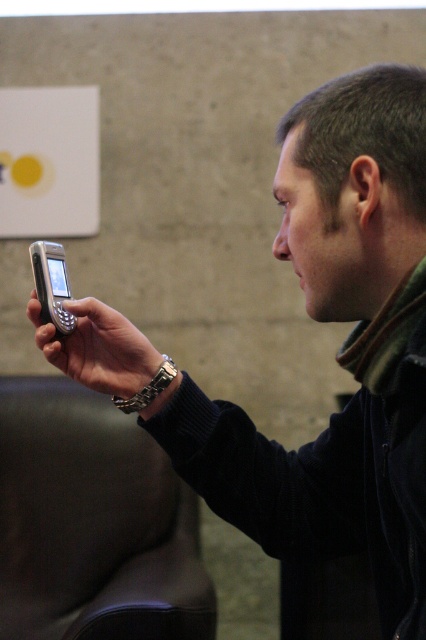
Is silver metallic phone at center shorter than matte black phone at center?

In fact, silver metallic phone at center may be taller than matte black phone at center.

Who is shorter, silver metallic phone at center or matte black phone at center?

With less height is matte black phone at center.

Describe the element at coordinates (97, 348) in the screenshot. I see `silver metallic phone at center` at that location.

Identify the location of silver metallic phone at center. (97, 348).

Can you confirm if leather-like armchair at lower left is positioned above silver metallic phone at center?

No, leather-like armchair at lower left is not above silver metallic phone at center.

Is leather-like armchair at lower left below silver metallic phone at center?

Indeed, leather-like armchair at lower left is positioned under silver metallic phone at center.

Which is in front, point (51, 625) or point (129, 332)?

Point (129, 332) is in front.

The image size is (426, 640). Find the location of `leather-like armchair at lower left`. leather-like armchair at lower left is located at coordinates (92, 522).

Does leather-like armchair at lower left have a greater width compared to matte black phone at center?

Yes.

You are a GUI agent. You are given a task and a screenshot of the screen. Output one action in this format:
    pyautogui.click(x=<x>, y=<y>)
    Task: Click on the leather-like armchair at lower left
    
    Given the screenshot: What is the action you would take?
    pyautogui.click(x=92, y=522)